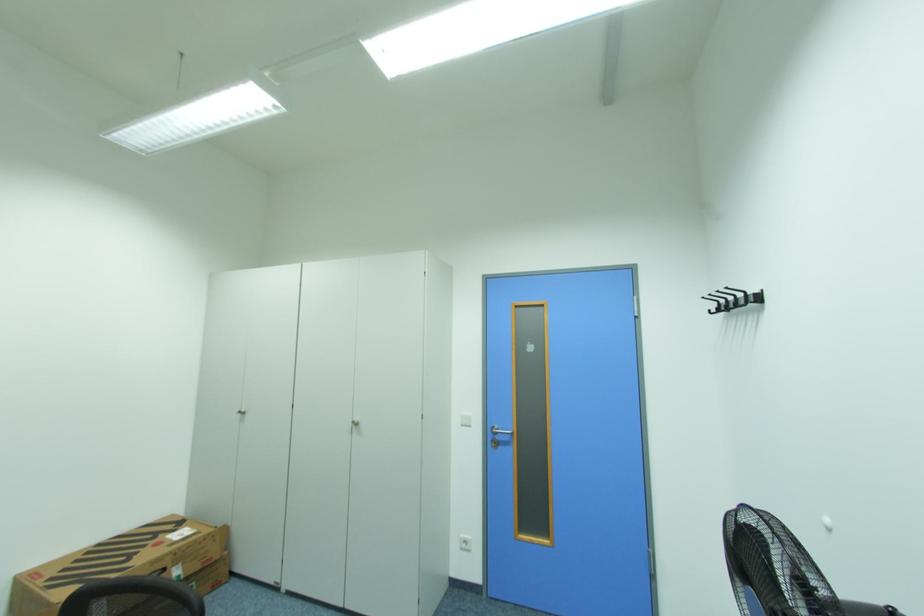
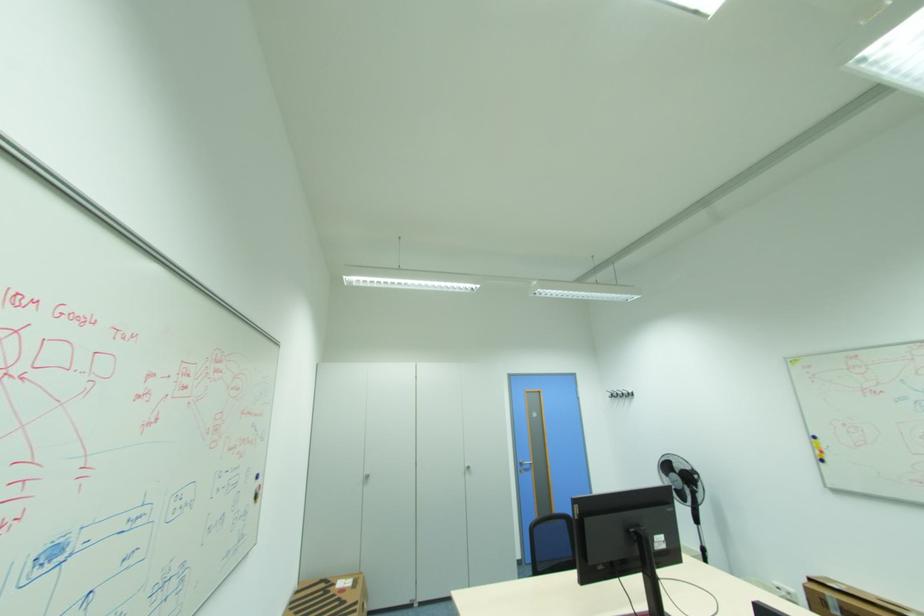
Locate, in the second image, the point that corresponds to [709,299] in the first image.

(613, 391)